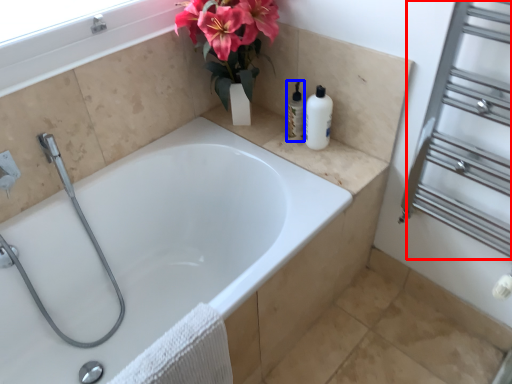
Question: Which of the following is the closest to the observer, screen door (highlighted by a red box) or toiletry (highlighted by a blue box)?

Choices:
 (A) screen door
 (B) toiletry

Answer: (A)